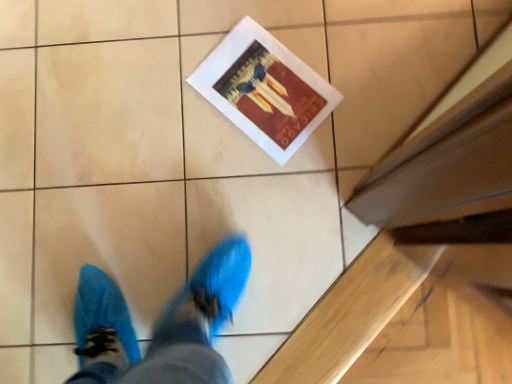
Find the location of a particular element. Image resolution: width=512 pixels, height=384 pixels. free spot above matte paper postcard at center (from a real-world perspective) is located at coordinates (264, 82).